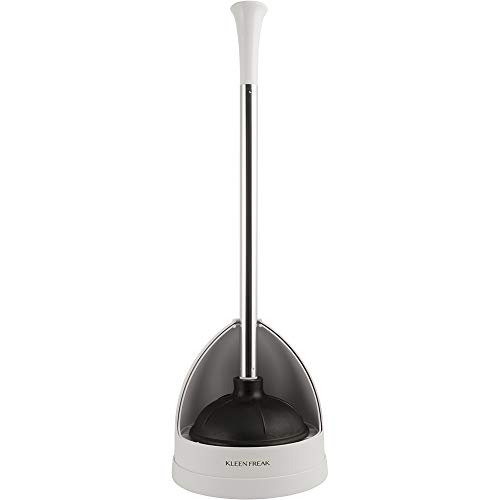
Find the location of `plunger stand`. plunger stand is located at coordinates (214, 474).